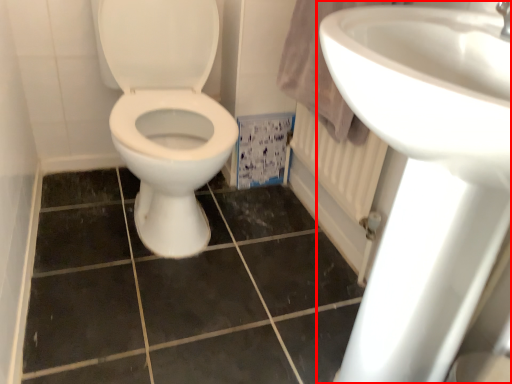
Question: Where is sink (annotated by the red box) located in relation to ceramic tile in the image?

Choices:
 (A) left
 (B) right

Answer: (B)